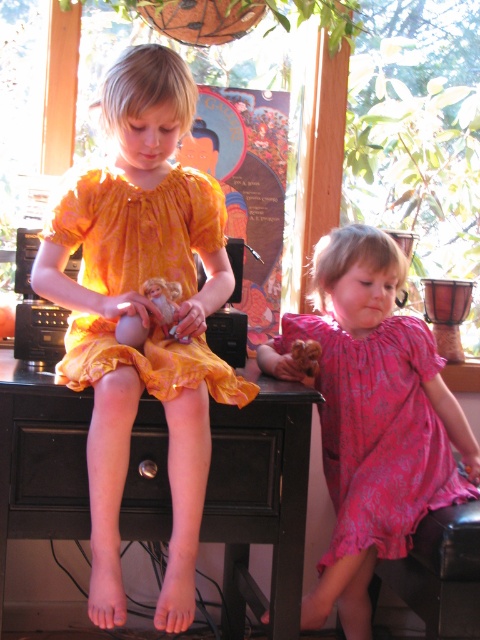
You are a photographer trying to capture a closeup of the orange printed dress at center and the matte pink doll at center. Which object should you zoom in on first to ensure it fills the frame properly?

The orange printed dress at center is larger than the matte pink doll at center, so you should zoom in on the orange printed dress at center first to ensure it fills the frame properly.

You are a photographer trying to capture a closeup of the orange printed dress at center without the matte pink doll at center blocking the view. Is this possible based on their current positions?

The orange printed dress at center is in front of the matte pink doll at center, so you can take a closeup of the orange printed dress at center without the matte pink doll at center blocking the view since it is behind.